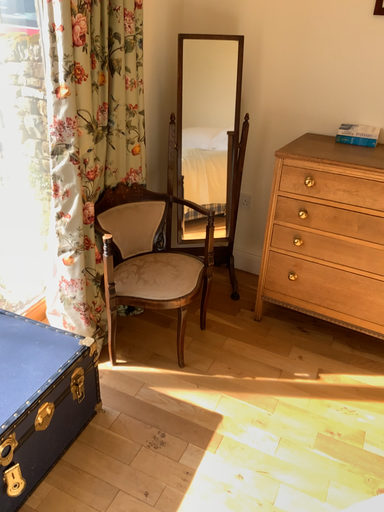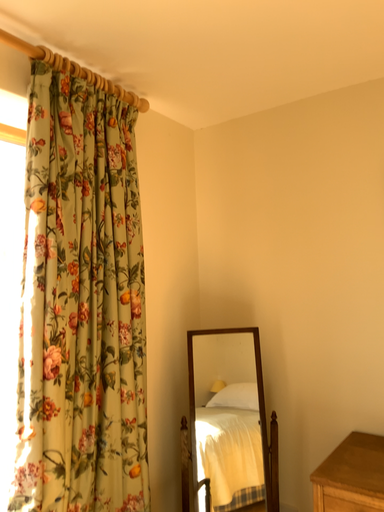
Question: How did the camera likely rotate when shooting the video?

Choices:
 (A) rotated right
 (B) rotated left

Answer: (B)